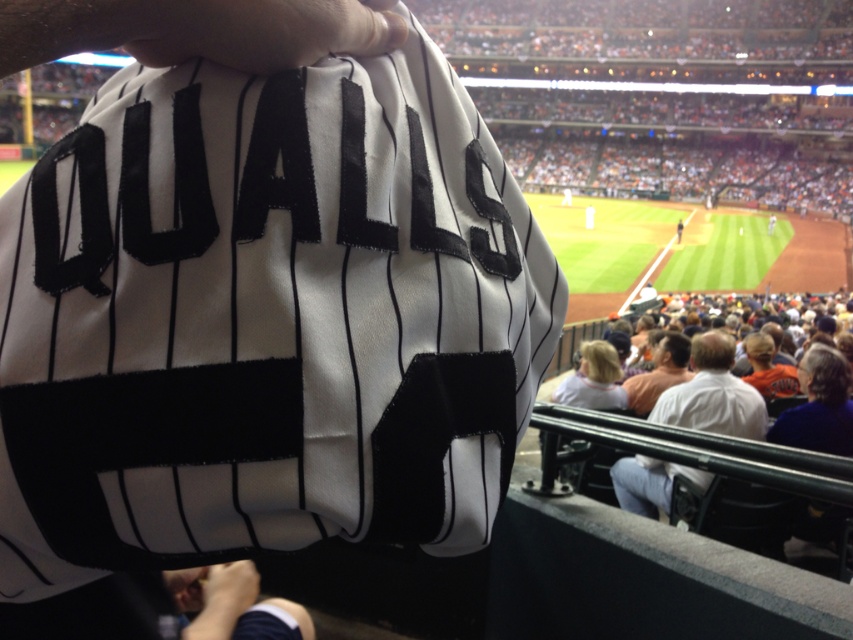
Question: Can you confirm if white matte baseball uniform at center is positioned below white fabric shirt at lower right?

Choices:
 (A) no
 (B) yes

Answer: (A)

Question: Based on their relative distances, which object is farther from the dark blue fabric at lower left?

Choices:
 (A) orange jersey at center
 (B) white matte baseball uniform at center

Answer: (A)

Question: Does dark blue fabric at lower left have a larger size compared to orange jersey at center?

Choices:
 (A) no
 (B) yes

Answer: (A)

Question: Among these objects, which one is farthest from the camera?

Choices:
 (A) white fabric shirt at lower right
 (B) dark blue fabric at lower left

Answer: (A)

Question: Which of the following is the farthest from the observer?

Choices:
 (A) orange jersey at center
 (B) white matte baseball uniform at center

Answer: (A)

Question: Does white matte baseball uniform at center appear on the right side of white fabric shirt at lower right?

Choices:
 (A) yes
 (B) no

Answer: (B)